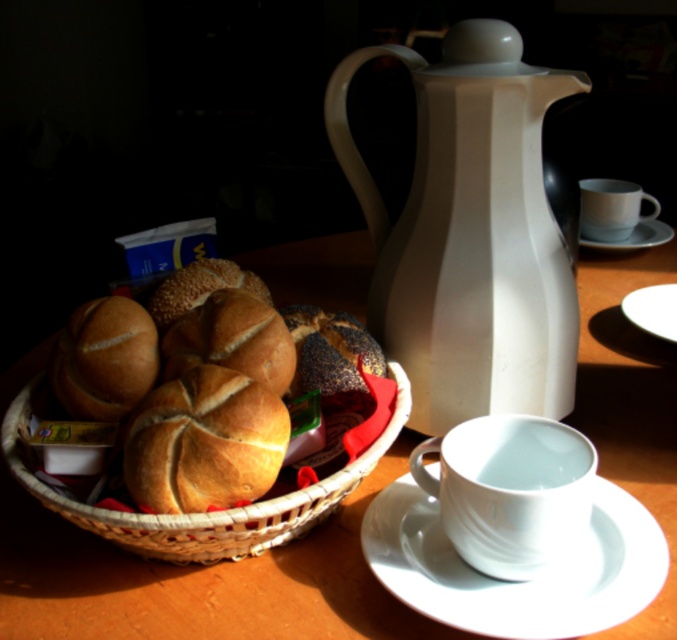
Between point (209, 346) and point (640, 323), which one is positioned in front?

Positioned in front is point (209, 346).

Between slightly golden matte bread at center and white ceramic plate at right, which one is positioned higher?

white ceramic plate at right is above.

The width and height of the screenshot is (677, 640). Describe the element at coordinates (232, 339) in the screenshot. I see `slightly golden matte bread at center` at that location.

What are the coordinates of `slightly golden matte bread at center` in the screenshot? It's located at (x=232, y=339).

Is white glossy teacup at lower center closer to the viewer compared to dark brown textured bread at center?

Yes.

Is white glossy teacup at lower center wider than dark brown textured bread at center?

Yes.

Between point (521, 452) and point (315, 321), which one is positioned in front?

Point (521, 452)

Where is `white glossy teacup at lower center`? The image size is (677, 640). white glossy teacup at lower center is located at coordinates (510, 490).

Who is positioned more to the right, white ceramic saucer at lower right or white ceramic saucer at right?

white ceramic saucer at right is more to the right.

Which is above, white ceramic saucer at lower right or white ceramic saucer at right?

white ceramic saucer at right

You are a GUI agent. You are given a task and a screenshot of the screen. Output one action in this format:
    pyautogui.click(x=<x>, y=<y>)
    Task: Click on the white ceramic saucer at lower right
    The width and height of the screenshot is (677, 640).
    Given the screenshot: What is the action you would take?
    pyautogui.click(x=512, y=580)